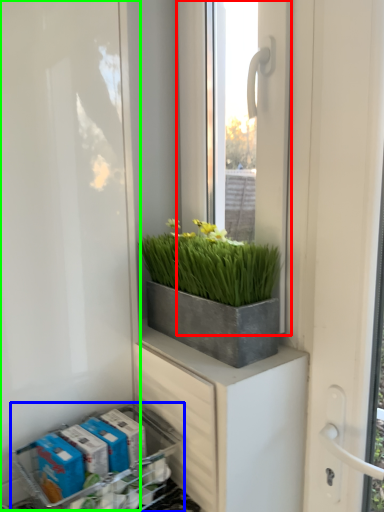
Question: Which is farther away from window (highlighted by a red box)? flower box (highlighted by a blue box) or screen door (highlighted by a green box)?

Choices:
 (A) flower box
 (B) screen door

Answer: (A)